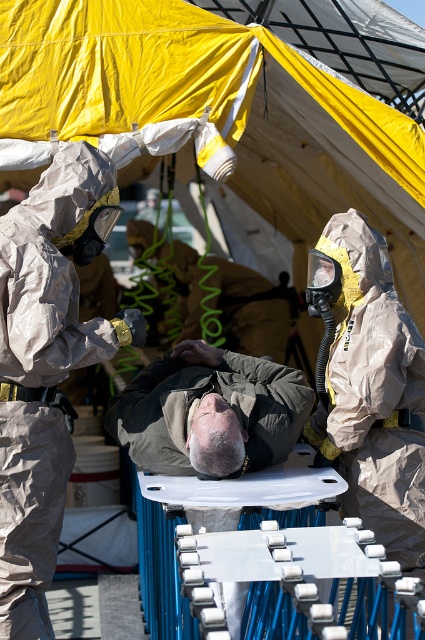
Can you confirm if gray matte uniform at center is positioned below matte gray uniform at center?

Yes.

Which is behind, point (201, 449) or point (277, 317)?

The point (277, 317) is more distant.

Does point (241, 406) come farther from viewer compared to point (212, 316)?

No, it is not.

I want to click on gray matte uniform at center, so click(209, 412).

Is matte gray hazmat suit at left positioned at the back of matte gray uniform at center?

No.

Does point (17, 566) lie in front of point (252, 326)?

Yes, it is in front of point (252, 326).

Between point (85, 157) and point (282, 358), which one is positioned in front?

Positioned in front is point (85, 157).

Image resolution: width=425 pixels, height=640 pixels. I want to click on matte gray hazmat suit at left, so click(x=44, y=376).

Between matte gray hazmat suit at left and gray matte uniform at center, which one has more height?

Standing taller between the two is matte gray hazmat suit at left.

Does matte gray hazmat suit at left have a greater height compared to gray matte uniform at center?

Indeed, matte gray hazmat suit at left has a greater height compared to gray matte uniform at center.

Is point (61, 180) behind point (166, 372)?

No, (61, 180) is in front of (166, 372).

You are a GUI agent. You are given a task and a screenshot of the screen. Output one action in this format:
    pyautogui.click(x=<x>, y=<y>)
    Task: Click on the matte gray hazmat suit at left
    This screenshot has width=425, height=640.
    Given the screenshot: What is the action you would take?
    pyautogui.click(x=44, y=376)